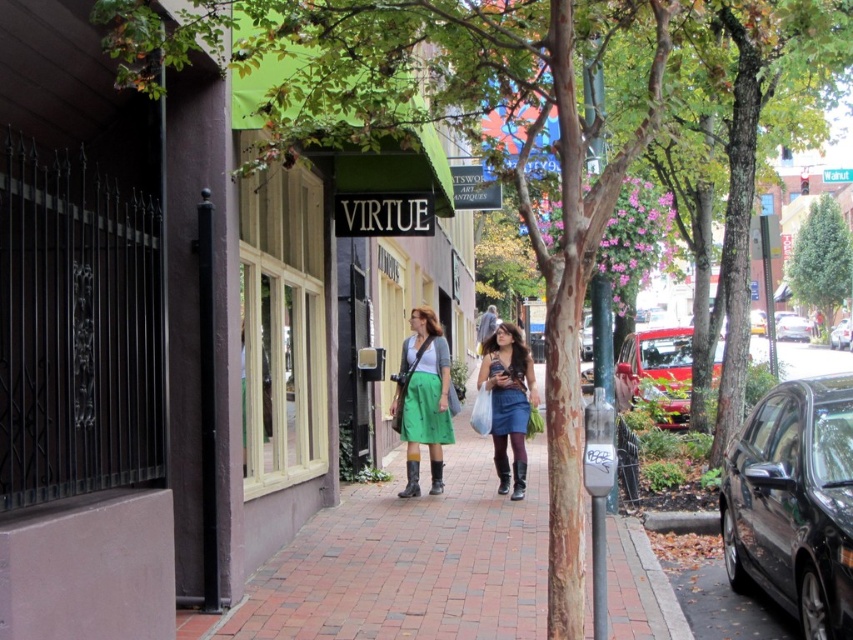
Can you confirm if green matte skirt at center is thinner than shiny red car at right?

Yes, green matte skirt at center is thinner than shiny red car at right.

Between green matte skirt at center and shiny red car at right, which one has more height?

Standing taller between the two is green matte skirt at center.

What are the coordinates of `green matte skirt at center` in the screenshot? It's located at (422, 397).

Is matte green skirt at center above shiny red car at right?

Actually, matte green skirt at center is below shiny red car at right.

Which of these two, matte green skirt at center or shiny red car at right, stands taller?

Standing taller between the two is matte green skirt at center.

You are a GUI agent. You are given a task and a screenshot of the screen. Output one action in this format:
    pyautogui.click(x=<x>, y=<y>)
    Task: Click on the matte green skirt at center
    
    Given the screenshot: What is the action you would take?
    pyautogui.click(x=508, y=401)

At what (x,y) coordinates should I click in order to perform the action: click on matte green skirt at center. Please return your answer as a coordinate pair (x, y). Looking at the image, I should click on (508, 401).

Is brick pavement at center taller than shiny black sedan at right?

In fact, brick pavement at center may be shorter than shiny black sedan at right.

Between point (445, 570) and point (844, 340), which one is positioned behind?

The point (844, 340) is more distant.

Is point (436, 572) positioned in front of point (851, 326)?

Yes, it is in front of point (851, 326).

The width and height of the screenshot is (853, 640). In order to click on brick pavement at center in this screenshot , I will do `click(405, 563)`.